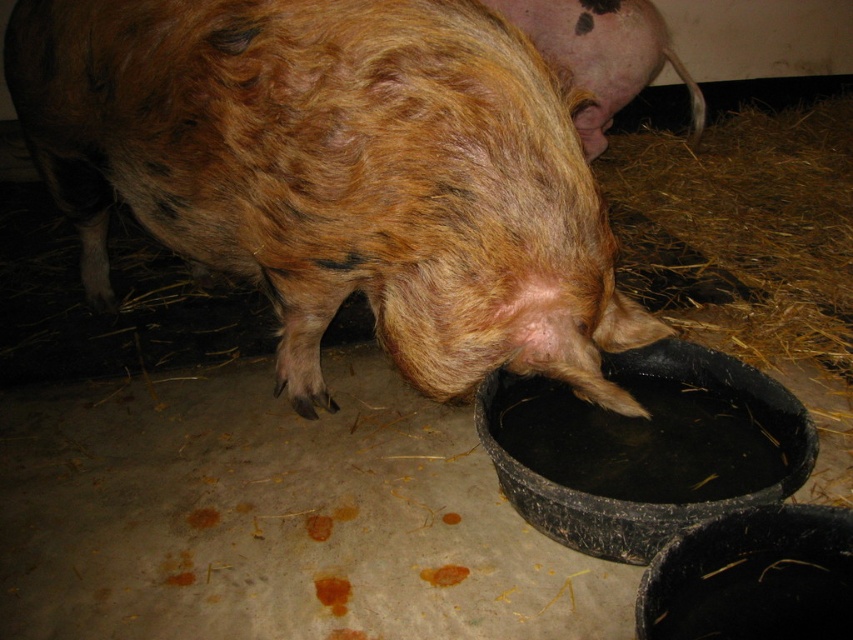
Measure the distance between brown furry pig at center and pink soft skin at upper right.

brown furry pig at center and pink soft skin at upper right are 29.91 inches apart.

Identify the location of brown furry pig at center. (339, 173).

This screenshot has width=853, height=640. Find the location of `brown furry pig at center`. brown furry pig at center is located at coordinates (339, 173).